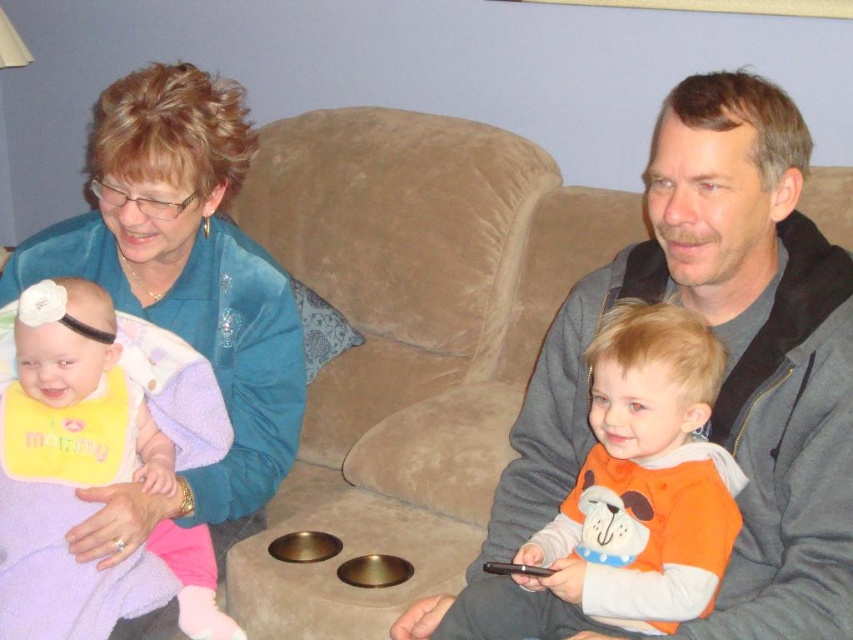
Is point (113, 180) more distant than point (686, 476)?

Yes.

Who is more distant from viewer, (178, 292) or (653, 611)?

Positioned behind is point (178, 292).

Locate an element on the screen. teal velvet jacket at upper left is located at coordinates (183, 291).

Is gray fleece jacket at center to the right of orange soft fabric baby at center from the viewer's perspective?

Indeed, gray fleece jacket at center is positioned on the right side of orange soft fabric baby at center.

Does gray fleece jacket at center have a greater width compared to orange soft fabric baby at center?

Yes, gray fleece jacket at center is wider than orange soft fabric baby at center.

Does point (502, 552) come farther from viewer compared to point (712, 401)?

Yes, point (502, 552) is behind point (712, 401).

Locate an element on the screen. The width and height of the screenshot is (853, 640). gray fleece jacket at center is located at coordinates (727, 356).

Can you confirm if teal velvet jacket at upper left is positioned below yellow bib at left?

Incorrect, teal velvet jacket at upper left is not positioned below yellow bib at left.

Does teal velvet jacket at upper left appear on the right side of yellow bib at left?

Correct, you'll find teal velvet jacket at upper left to the right of yellow bib at left.

Measure the distance between teal velvet jacket at upper left and camera.

teal velvet jacket at upper left is 3.99 feet from camera.

In order to click on teal velvet jacket at upper left in this screenshot , I will do `click(183, 291)`.